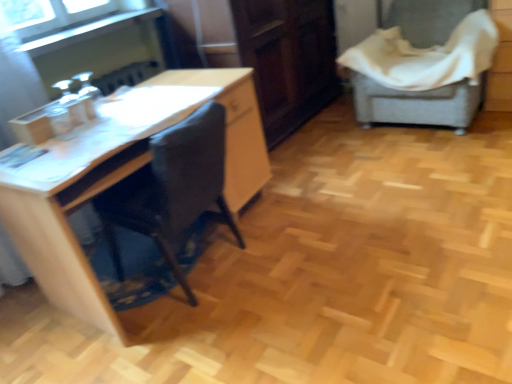
What is the approximate height of wooden desk at left?

wooden desk at left is 28.89 inches in height.

Image resolution: width=512 pixels, height=384 pixels. What do you see at coordinates (288, 59) in the screenshot?
I see `dark wood/file cabinet at center` at bounding box center [288, 59].

Where is `wooden desk at left`? This screenshot has width=512, height=384. wooden desk at left is located at coordinates (123, 177).

Which of these two, wooden desk at left or gray fabric-covered chair at right, is bigger?

gray fabric-covered chair at right.

From the image's perspective, is wooden desk at left over gray fabric-covered chair at right?

No, from the image's perspective, wooden desk at left is not above gray fabric-covered chair at right.

Which object is more forward, wooden desk at left or gray fabric-covered chair at right?

wooden desk at left is closer to the camera.

From a real-world perspective, which is physically below, dark wood/file cabinet at center or wooden desk at left?

wooden desk at left is physically lower.

Who is taller, dark wood/file cabinet at center or wooden desk at left?

With more height is dark wood/file cabinet at center.

From the image's perspective, is dark wood/file cabinet at center located above or below wooden desk at left?

From the image's perspective, dark wood/file cabinet at center appears above wooden desk at left.

Where is `desk on the right of clear glass window at upper left`? The height and width of the screenshot is (384, 512). desk on the right of clear glass window at upper left is located at coordinates (123, 177).

Who is smaller, clear glass window at upper left or wooden desk at left?

clear glass window at upper left.

Considering the sizes of clear glass window at upper left and wooden desk at left in the image, is clear glass window at upper left wider or thinner than wooden desk at left?

In the image, clear glass window at upper left appears to be more narrow than wooden desk at left.

Is clear glass window at upper left inside the boundaries of wooden desk at left, or outside?

clear glass window at upper left is not enclosed by wooden desk at left.

Who is taller, dark wood/file cabinet at center or gray fabric-covered chair at right?

dark wood/file cabinet at center is taller.

Can you confirm if dark wood/file cabinet at center is smaller than gray fabric-covered chair at right?

No, dark wood/file cabinet at center is not smaller than gray fabric-covered chair at right.

Is dark wood/file cabinet at center wider than gray fabric-covered chair at right?

No, dark wood/file cabinet at center is not wider than gray fabric-covered chair at right.

Which is more to the right, dark wood/file cabinet at center or gray fabric-covered chair at right?

gray fabric-covered chair at right.

Is gray fabric-covered chair at right to the right of dark wood/file cabinet at center from the viewer's perspective?

Indeed, gray fabric-covered chair at right is positioned on the right side of dark wood/file cabinet at center.

From a real-world perspective, which object stands above the other?

dark wood/file cabinet at center is physically above.

What's the angular difference between gray fabric-covered chair at right and dark wood/file cabinet at center's facing directions?

They differ by 87.5 degrees in their facing directions.

Does gray fabric-covered chair at right have a smaller size compared to dark wood/file cabinet at center?

Correct, gray fabric-covered chair at right occupies less space than dark wood/file cabinet at center.

Which of these two, gray fabric-covered chair at right or clear glass window at upper left, is thinner?

With smaller width is clear glass window at upper left.

Is gray fabric-covered chair at right not inside clear glass window at upper left?

Yes, gray fabric-covered chair at right is outside of clear glass window at upper left.

Is gray fabric-covered chair at right placed right next to clear glass window at upper left?

There is a gap between gray fabric-covered chair at right and clear glass window at upper left.

In the scene shown: Is the position of gray fabric-covered chair at right less distant than that of clear glass window at upper left?

That is False.

Which of these two, gray fabric-covered chair at right or wooden desk at left, is bigger?

gray fabric-covered chair at right.

From a real-world perspective, is gray fabric-covered chair at right beneath wooden desk at left?

Incorrect, from a real-world perspective, gray fabric-covered chair at right is higher than wooden desk at left.

From the picture: Could wooden desk at left be considered to be inside gray fabric-covered chair at right?

No, wooden desk at left is located outside of gray fabric-covered chair at right.

You are a GUI agent. You are given a task and a screenshot of the screen. Output one action in this format:
    pyautogui.click(x=<x>, y=<y>)
    Task: Click on the chair on the right of wooden desk at left
    The height and width of the screenshot is (384, 512).
    Given the screenshot: What is the action you would take?
    pyautogui.click(x=423, y=68)

The width and height of the screenshot is (512, 384). There is a wooden desk at left. Identify the location of file cabinet above it (from a real-world perspective). (288, 59).

When comparing their distances from wooden desk at left, does clear glass window at upper left or gray fabric-covered chair at right seem further?

gray fabric-covered chair at right is positioned further to the anchor wooden desk at left.

Based on their spatial positions, is dark wood/file cabinet at center or gray fabric-covered chair at right closer to wooden desk at left?

The object closer to wooden desk at left is dark wood/file cabinet at center.

Estimate the real-world distances between objects in this image. Which object is closer to clear glass window at upper left, dark wood/file cabinet at center or wooden desk at left?

Among the two, wooden desk at left is located nearer to clear glass window at upper left.

When comparing their distances from dark wood/file cabinet at center, does clear glass window at upper left or wooden desk at left seem closer?

wooden desk at left is positioned closer to the anchor dark wood/file cabinet at center.

Based on their spatial positions, is gray fabric-covered chair at right or dark wood/file cabinet at center closer to clear glass window at upper left?

Among the two, dark wood/file cabinet at center is located nearer to clear glass window at upper left.

When comparing their distances from gray fabric-covered chair at right, does wooden desk at left or clear glass window at upper left seem closer?

wooden desk at left lies closer to gray fabric-covered chair at right than the other object.

Considering their positions, is dark wood/file cabinet at center positioned closer to wooden desk at left than clear glass window at upper left?

Based on the image, clear glass window at upper left appears to be nearer to wooden desk at left.

Based on their spatial positions, is clear glass window at upper left or gray fabric-covered chair at right further from dark wood/file cabinet at center?

clear glass window at upper left is further to dark wood/file cabinet at center.

Locate an element on the screen. file cabinet situated between clear glass window at upper left and gray fabric-covered chair at right from left to right is located at coordinates (288, 59).

Identify the location of desk situated between clear glass window at upper left and dark wood/file cabinet at center from left to right. (123, 177).

Find the location of a particular element. file cabinet between wooden desk at left and gray fabric-covered chair at right from left to right is located at coordinates (288, 59).

Find the location of a particular element. The image size is (512, 384). desk between clear glass window at upper left and gray fabric-covered chair at right from left to right is located at coordinates (123, 177).